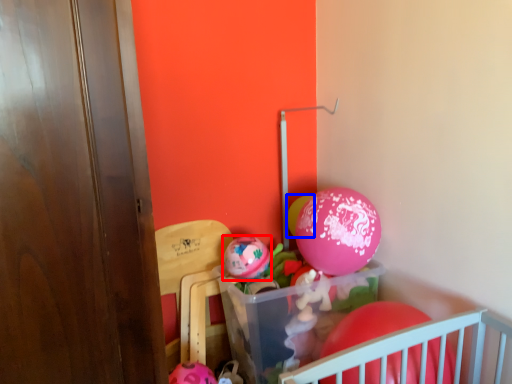
Question: Which object is closer to the camera taking this photo, balloon (highlighted by a red box) or balloon (highlighted by a blue box)?

Choices:
 (A) balloon
 (B) balloon

Answer: (A)